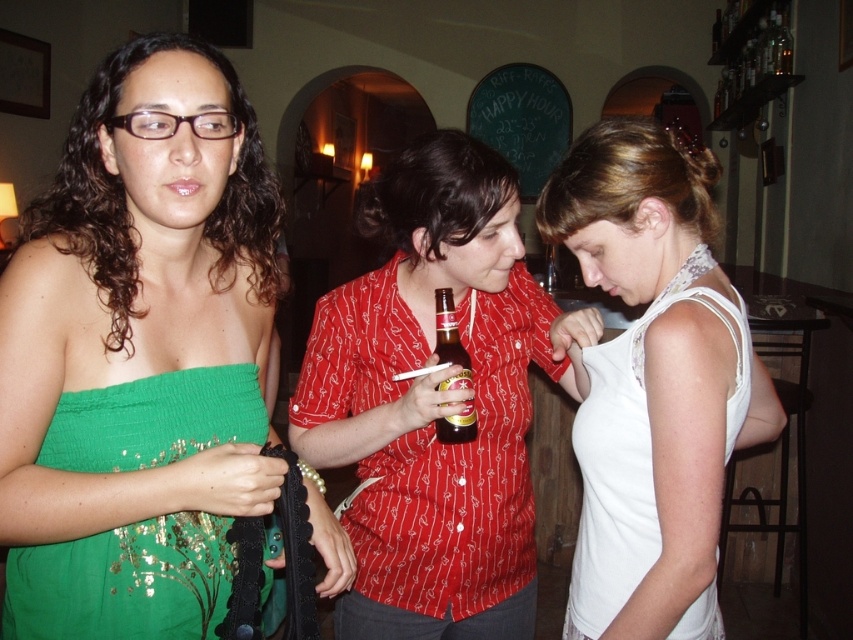
Is matte red shirt at center bigger than white lace tank top at center?

Yes, matte red shirt at center is bigger than white lace tank top at center.

Who is more forward, (x=467, y=250) or (x=614, y=435)?

Point (x=614, y=435) is in front.

Is point (328, 429) closer to camera compared to point (625, 428)?

No.

Find the location of `matte red shirt at center`. matte red shirt at center is located at coordinates (436, 401).

Is matte red shirt at center above green sequined dress at center?

Correct, matte red shirt at center is located above green sequined dress at center.

Does matte red shirt at center have a smaller size compared to green sequined dress at center?

Actually, matte red shirt at center might be larger than green sequined dress at center.

Does point (494, 484) come closer to viewer compared to point (109, 417)?

That is False.

The image size is (853, 640). I want to click on matte red shirt at center, so click(436, 401).

Does green sequined dress at left have a larger size compared to green sequined dress at center?

Yes, green sequined dress at left is bigger than green sequined dress at center.

Which is in front, point (22, 252) or point (173, 556)?

Point (22, 252) is more forward.

What are the coordinates of `green sequined dress at left` in the screenshot? It's located at (140, 356).